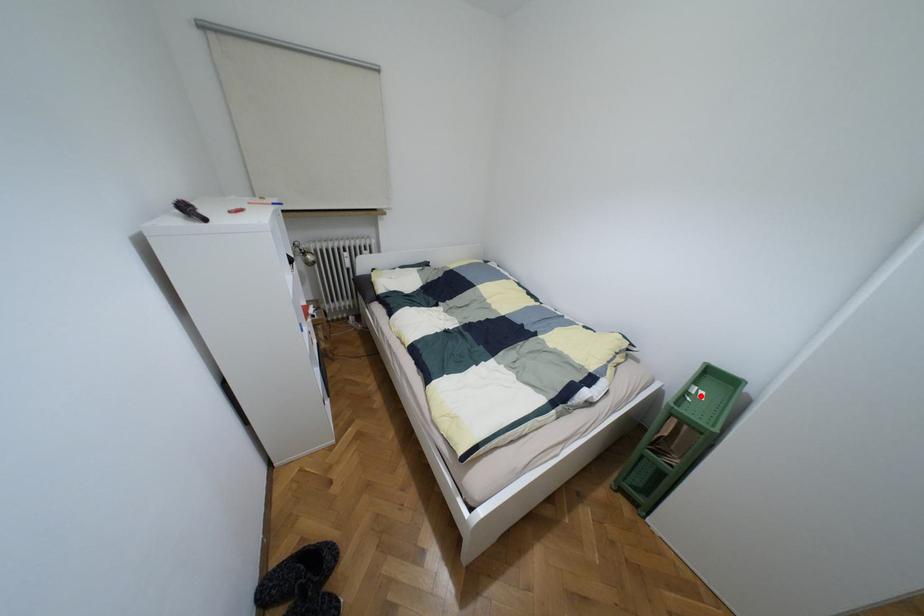
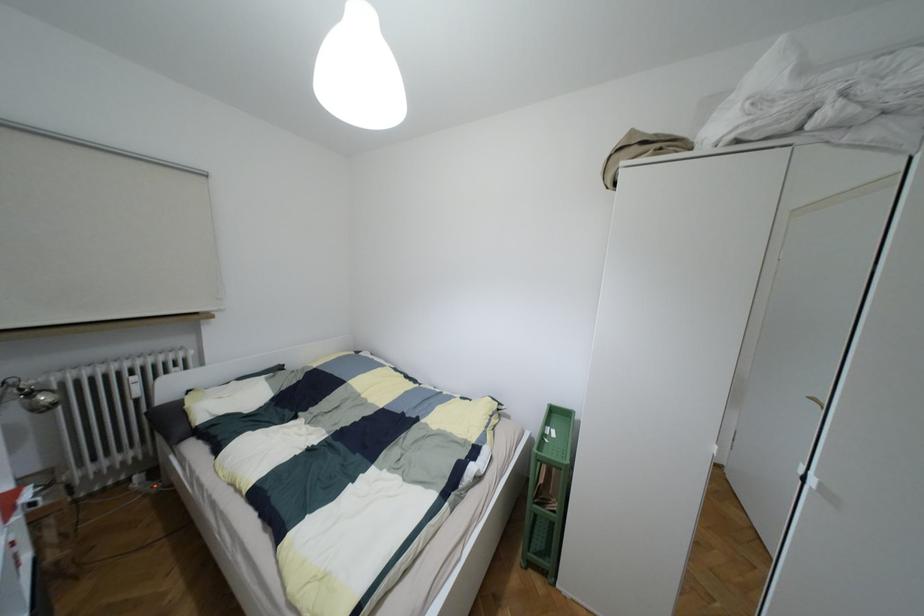
In the second image, find the point that corresponds to the highlighted location in the first image.

(553, 434)